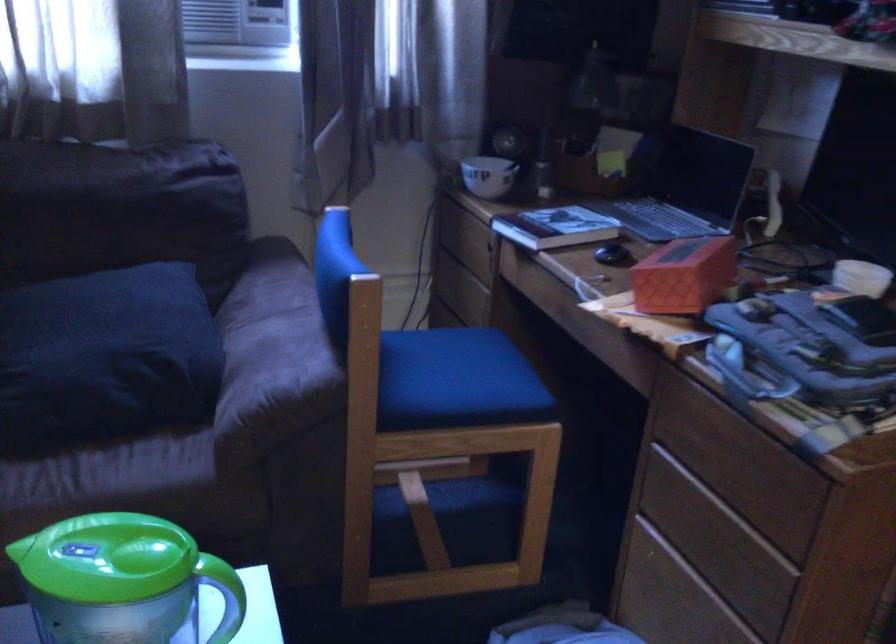
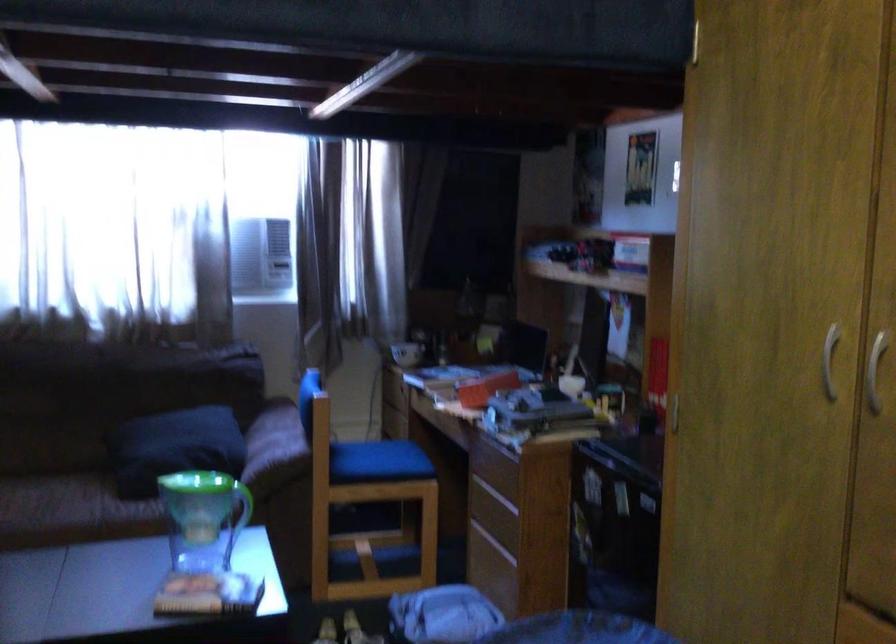
In the second image, find the point that corresponds to point 458,383 in the first image.

(377, 462)